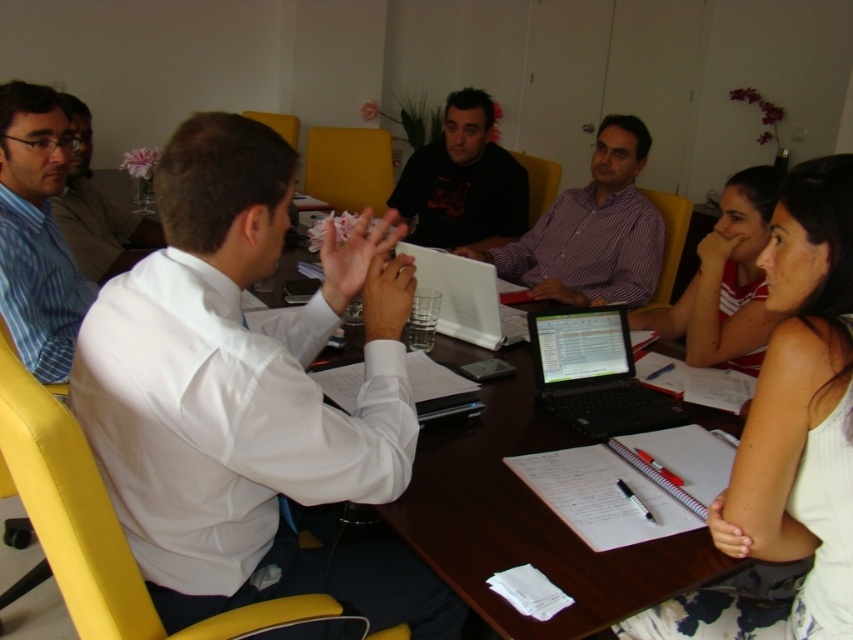
You are an attendee at this meeting and need to pass a document to the person wearing the white fabric shirt at upper right. You are currently sitting at the position of the matte black shirt at left. Can you directly hand the document to them without getting up from your seat?

The white fabric shirt at upper right is located below the matte black shirt at left. Since the white fabric shirt at upper right is positioned lower than the matte black shirt at left, you cannot directly hand the document to them while remaining seated because they are positioned further down from your current seat.

You are attending a meeting and notice two shirts at the center of the table. Which shirt is closer to you, the striped cotton shirt at center or the black matte shirt at center?

The striped cotton shirt at center is closer to you because it is positioned under the black matte shirt at center, meaning it is in front and therefore nearer to your viewpoint.

You are a photographer in the room and want to take a photo of the white fabric shirt at upper right and the matte black shirt at left. Which shirt should you zoom in more on to make them appear the same size in the photo?

The white fabric shirt at upper right is smaller than the matte black shirt at left, so you should zoom in more on the white fabric shirt at upper right to make them appear the same size in the photo.